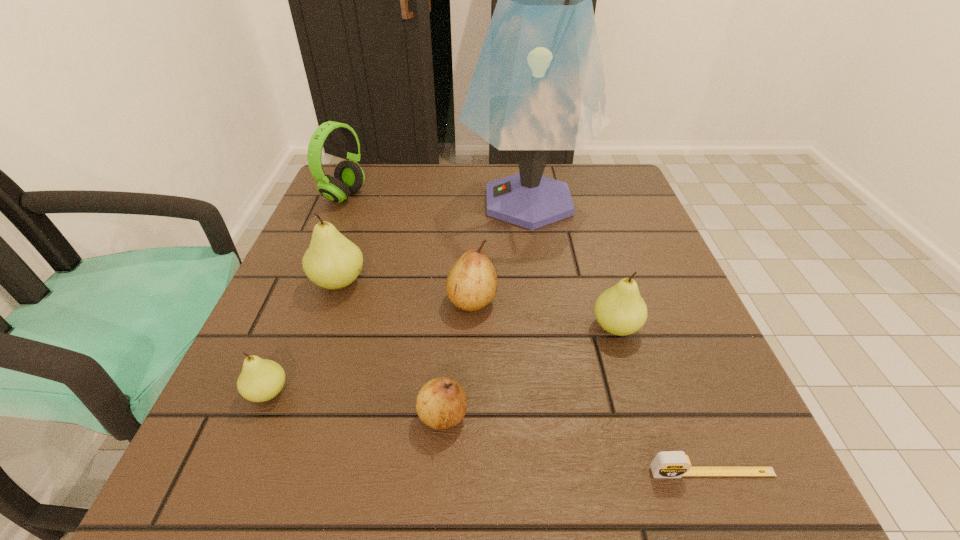
This screenshot has width=960, height=540. Find the location of `object present at the near right corner`. object present at the near right corner is located at coordinates (667, 464).

Locate an element on the screen. This screenshot has width=960, height=540. free space at the far edge of the desktop is located at coordinates (457, 208).

Where is `vacant area at the near edge of the desktop`? Image resolution: width=960 pixels, height=540 pixels. vacant area at the near edge of the desktop is located at coordinates (612, 463).

The width and height of the screenshot is (960, 540). Find the location of `vacant position at the left edge of the desktop`. vacant position at the left edge of the desktop is located at coordinates 363,250.

In the image, there is a desktop. Where is `vacant region at the right edge`? This screenshot has height=540, width=960. vacant region at the right edge is located at coordinates (647, 353).

The image size is (960, 540). In the image, there is a desktop. Identify the location of free space at the far left corner. (376, 177).

This screenshot has width=960, height=540. I want to click on vacant area at the near left corner, so click(x=198, y=473).

The image size is (960, 540). In order to click on vacant area at the far right corner in this screenshot , I will do `click(602, 179)`.

This screenshot has height=540, width=960. I want to click on empty location between the smallest green pear and the biggest green pear, so click(x=303, y=337).

Find the location of a particular element. The image size is (960, 540). free area in between the bigger brown pear and the second farthest green pear is located at coordinates click(544, 314).